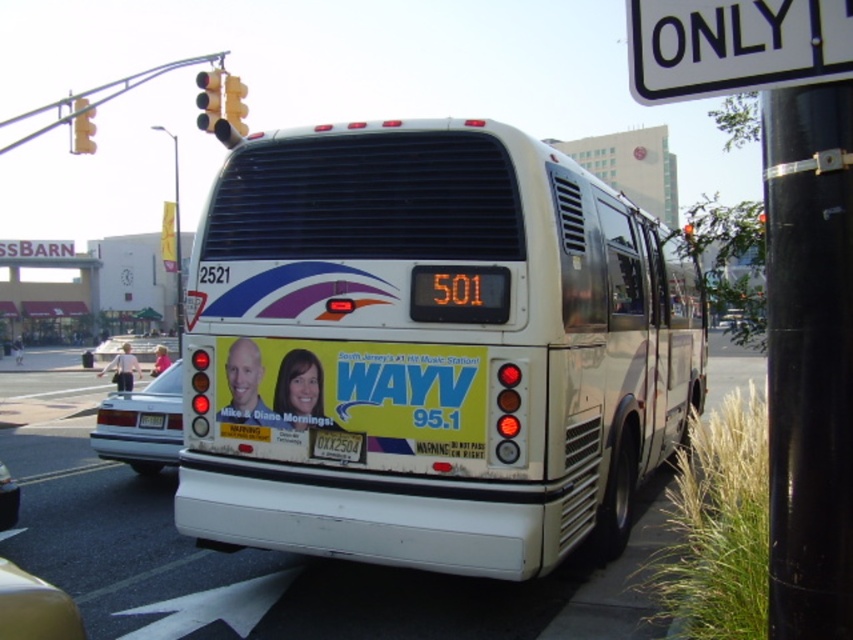
Does white glossy tour bus at center lie in front of yellow glass traffic light at upper left?

Yes, it is.

Is point (560, 260) positioned after point (204, 97)?

No, (560, 260) is in front of (204, 97).

Describe the element at coordinates (428, 349) in the screenshot. The width and height of the screenshot is (853, 640). I see `white glossy tour bus at center` at that location.

The height and width of the screenshot is (640, 853). In order to click on white glossy tour bus at center in this screenshot , I will do `click(428, 349)`.

Which is above, silver metallic sedan at lower left or white plastic license plate at center?

Positioned higher is white plastic license plate at center.

Does silver metallic sedan at lower left appear under white plastic license plate at center?

Correct, silver metallic sedan at lower left is located below white plastic license plate at center.

I want to click on silver metallic sedan at lower left, so click(x=140, y=428).

Is yellow plastic traffic light at upper center smaller than white plastic license plate at center?

Incorrect, yellow plastic traffic light at upper center is not smaller in size than white plastic license plate at center.

Is yellow plastic traffic light at upper center bigger than white plastic license plate at center?

Yes, yellow plastic traffic light at upper center is bigger than white plastic license plate at center.

Who is more distant from viewer, (244, 116) or (148, 419)?

The point (244, 116) is behind.

The width and height of the screenshot is (853, 640). What are the coordinates of `yellow plastic traffic light at upper center` in the screenshot? It's located at [235, 102].